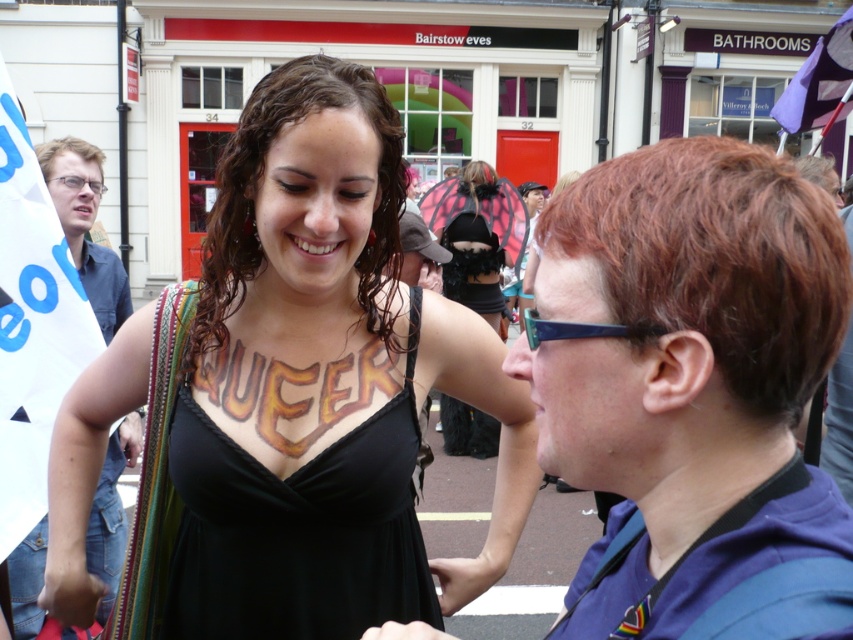
Question: Based on their relative distances, which object is farther from the blue plastic glasses at upper center?

Choices:
 (A) matte blue hoodie at center
 (B) black matte dress at center

Answer: (B)

Question: Estimate the real-world distances between objects in this image. Which object is closer to the black fabric dress at center?

Choices:
 (A) matte blue hoodie at center
 (B) short brown hair at center
 (C) black matte dress at center

Answer: (C)

Question: Does short brown hair at center have a greater width compared to matte black dress at center?

Choices:
 (A) yes
 (B) no

Answer: (B)

Question: Which object is positioned closest to the matte blue hoodie at center?

Choices:
 (A) short brown hair at center
 (B) blue plastic glasses at upper center
 (C) blue denim jeans at left
 (D) matte black dress at center

Answer: (A)

Question: Can you confirm if black fabric dress at center is wider than blue denim jeans at left?

Choices:
 (A) yes
 (B) no

Answer: (A)

Question: Is matte blue hoodie at center thinner than black fabric dress at center?

Choices:
 (A) no
 (B) yes

Answer: (B)